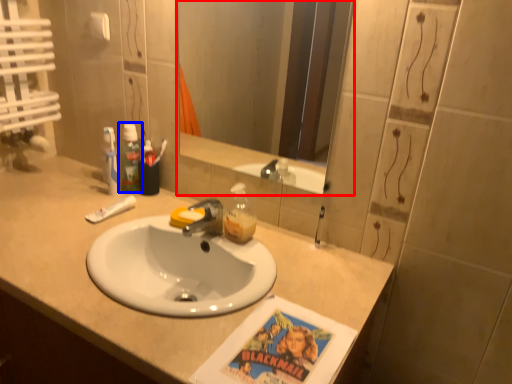
Question: Among these objects, which one is farthest to the camera, mirror (highlighted by a red box) or mouthwash (highlighted by a blue box)?

Choices:
 (A) mirror
 (B) mouthwash

Answer: (B)